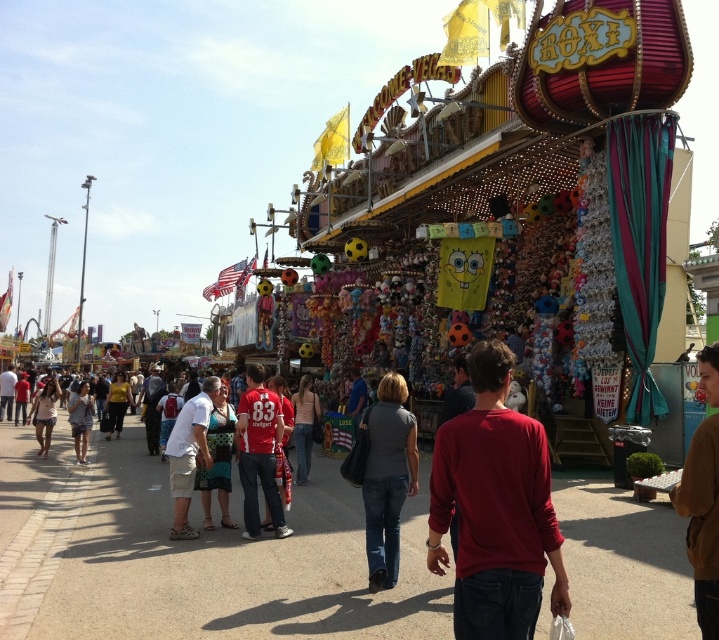
You are standing at the entrance of the fairground and see the red cotton shirt at center and the brown fuzzy sweater at lower right. Which piece of clothing is closer to you?

The red cotton shirt at center is closer to you because it is further to the viewer than the brown fuzzy sweater at lower right.

You are a photographer standing at the edge of the fairground pathway. You want to take a photo that includes both the red cotton shirt at center and the gray matte shirt at center. What is the minimum distance you need to move backward to ensure both shirts are in frame?

The red cotton shirt at center and gray matte shirt at center are 11.01 meters apart from each other. To include both in the frame, you need to move backward until the camera can capture a field of view that spans at least 11.01 meters. The exact distance depends on the camera lens, but moving back several meters should help.